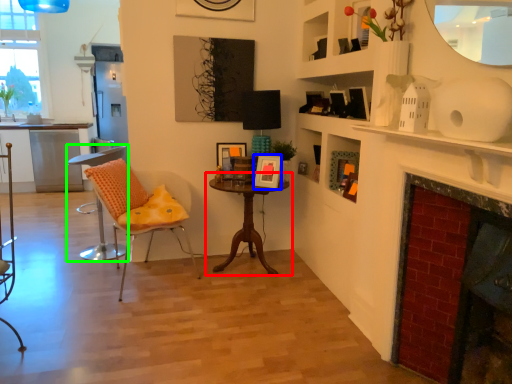
Question: Estimate the real-world distances between objects in this image. Which object is farther from table (highlighted by a red box), picture frame (highlighted by a blue box) or chair (highlighted by a green box)?

Choices:
 (A) picture frame
 (B) chair

Answer: (B)